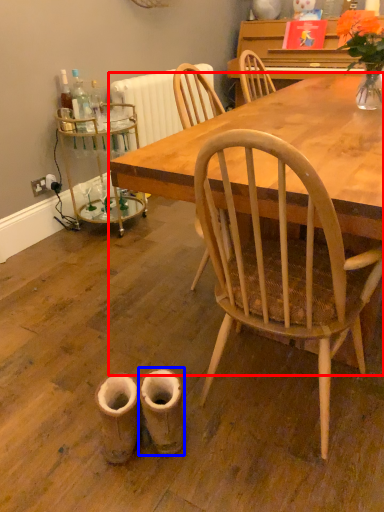
Question: Which of the following is the farthest to the observer, desk (highlighted by a red box) or walking shoe (highlighted by a blue box)?

Choices:
 (A) desk
 (B) walking shoe

Answer: (B)